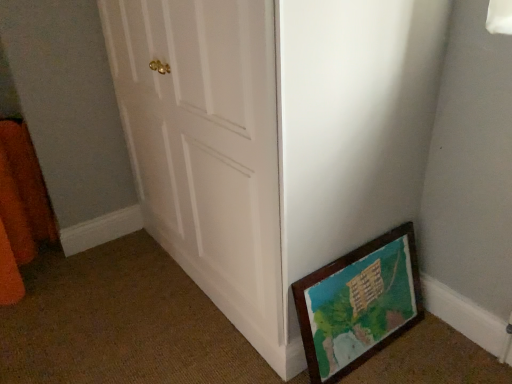
You are a GUI agent. You are given a task and a screenshot of the screen. Output one action in this format:
    pyautogui.click(x=<x>, y=<y>)
    Task: Click on the free spot in front of orange fuzzy curtain at left
    The image size is (512, 384).
    Given the screenshot: What is the action you would take?
    pyautogui.click(x=41, y=317)